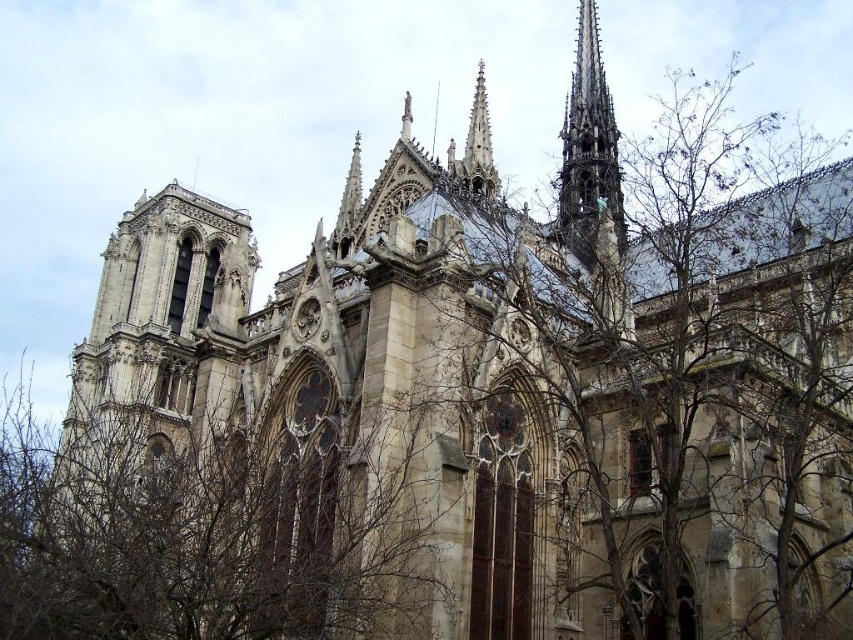
You are a tourist standing in front of the Notre Dame Cathedral. You want to take a photo of the stone spire at upper right. Where exactly should you aim your camera to capture it?

The stone spire at upper right is located at coordinates point (589, 148), so you should aim your camera at that specific point to capture it.

You are standing in front of the Notre Dame Cathedral and want to take a photo. You notice two points marked in the scene. Which point is closer to you, point (241, 444) or point (561, 189)?

Point (241, 444) is closer to the viewer than point (561, 189).

In the scene shown: You are a photographer standing at the base of the Notre Dame Cathedral. You want to take a picture of the stone spire at upper right but there are brown leafless branches at lower left blocking your view. Can you estimate how far you need to move backward to get the spire fully in frame without the branches?

The distance between the brown leafless branches at lower left and the stone spire at upper right is 62.74 meters. To ensure the branches are no longer blocking the view of the spire, you would need to move backward until you are at least 62.74 meters away from the branches, allowing the spire to be fully visible without obstruction.